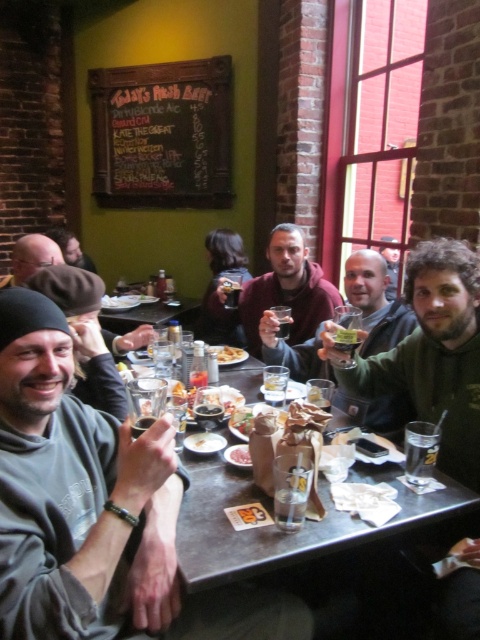
Question: Does matte black beanie at lower left appear on the left side of matte black beanie at upper left?

Choices:
 (A) yes
 (B) no

Answer: (A)

Question: Is matte black beanie at upper left to the left of smooth leather jacket at upper center from the viewer's perspective?

Choices:
 (A) no
 (B) yes

Answer: (B)

Question: Among these objects, which one is nearest to the camera?

Choices:
 (A) smooth white plate at center
 (B) black chalkboard at upper center

Answer: (A)

Question: Among these objects, which one is nearest to the camera?

Choices:
 (A) golden crispy fries at center
 (B) matte black beanie at lower left
 (C) smooth brown bread at center

Answer: (C)

Question: Which of the following is the farthest from the observer?

Choices:
 (A) (57, 256)
 (B) (388, 284)

Answer: (A)

Question: Does black chalkboard at upper center have a greater width compared to matte black beanie at lower left?

Choices:
 (A) no
 (B) yes

Answer: (B)